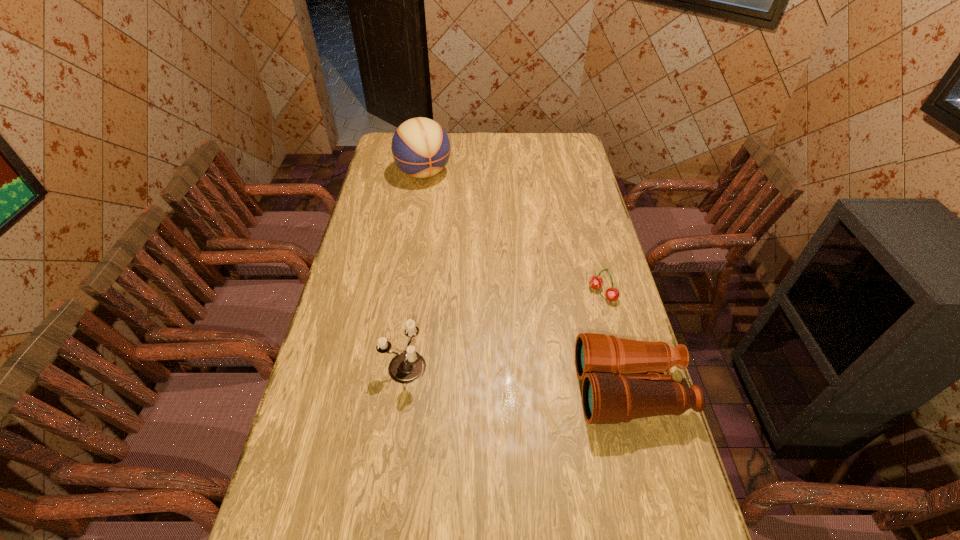
The height and width of the screenshot is (540, 960). What are the coordinates of `candle holder` in the screenshot? It's located at (407, 367).

Find the location of a particular element. binoculars is located at coordinates (612, 392).

In order to click on the tallest object in this screenshot , I will do click(x=421, y=148).

Identify the location of the farthest object. This screenshot has width=960, height=540. click(x=421, y=148).

You are a GUI agent. You are given a task and a screenshot of the screen. Output one action in this format:
    pyautogui.click(x=<x>, y=<y>)
    Task: Click on the third nearest object
    The image size is (960, 540).
    Given the screenshot: What is the action you would take?
    pyautogui.click(x=612, y=294)

Where is `the shortest object`? the shortest object is located at coordinates (612, 294).

Where is `vacant space located on the right of the candle holder`? The image size is (960, 540). vacant space located on the right of the candle holder is located at coordinates (560, 366).

You are a GUI agent. You are given a task and a screenshot of the screen. Output one action in this format:
    pyautogui.click(x=<x>, y=<y>)
    Task: Click on the free spot located through the lenses of the binoculars
    
    Given the screenshot: What is the action you would take?
    pyautogui.click(x=488, y=390)

Image resolution: width=960 pixels, height=540 pixels. In order to click on vacant region located 0.320m through the lenses of the binoculars in this screenshot , I will do `click(462, 390)`.

At what (x,y) coordinates should I click in order to perform the action: click on vacant area located through the lenses of the binoculars. Please return your answer as a coordinate pair (x, y). Looking at the image, I should click on (539, 390).